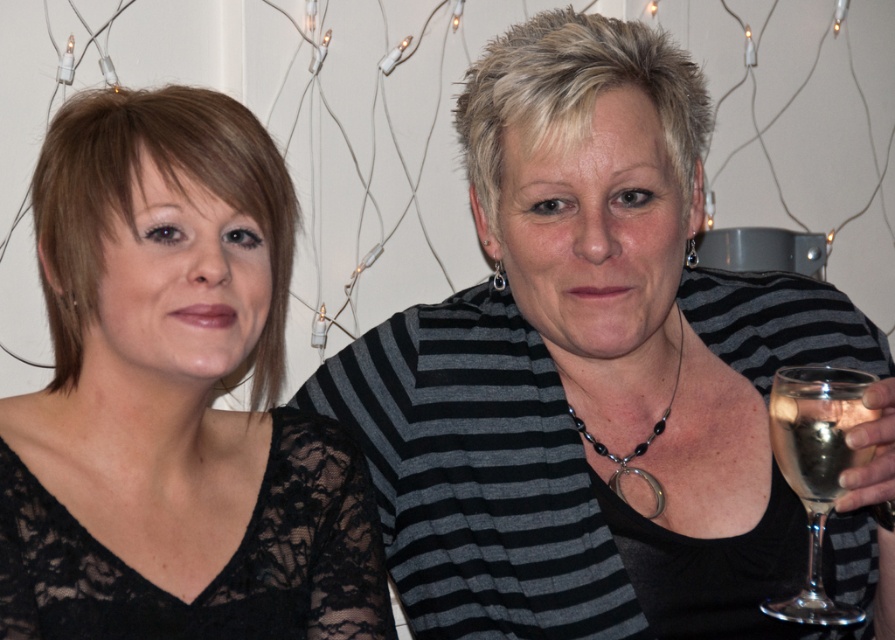
Which is in front, point (416, 413) or point (277, 392)?

Point (416, 413)

Which is in front, point (672, 100) or point (227, 212)?

Point (227, 212)

I want to click on black lace top at upper right, so click(x=601, y=378).

From the picture: Who is more distant from viewer, (757, 563) or (859, 390)?

Positioned behind is point (757, 563).

Is black lace top at upper right below clear glass wine glass at right?

Incorrect, black lace top at upper right is not positioned below clear glass wine glass at right.

Which is in front, point (593, 84) or point (800, 616)?

Point (800, 616)

Image resolution: width=895 pixels, height=640 pixels. I want to click on black lace top at upper right, so click(x=601, y=378).

Which is more to the right, clear glass wine glass at right or black beaded necklace at center?

clear glass wine glass at right

Can you confirm if clear glass wine glass at right is shorter than black beaded necklace at center?

Incorrect, clear glass wine glass at right's height does not fall short of black beaded necklace at center's.

Where is `clear glass wine glass at right`? The image size is (895, 640). clear glass wine glass at right is located at coordinates point(816,468).

At what (x,y) coordinates should I click in order to perform the action: click on clear glass wine glass at right. Please return your answer as a coordinate pair (x, y). This screenshot has height=640, width=895. Looking at the image, I should click on (816, 468).